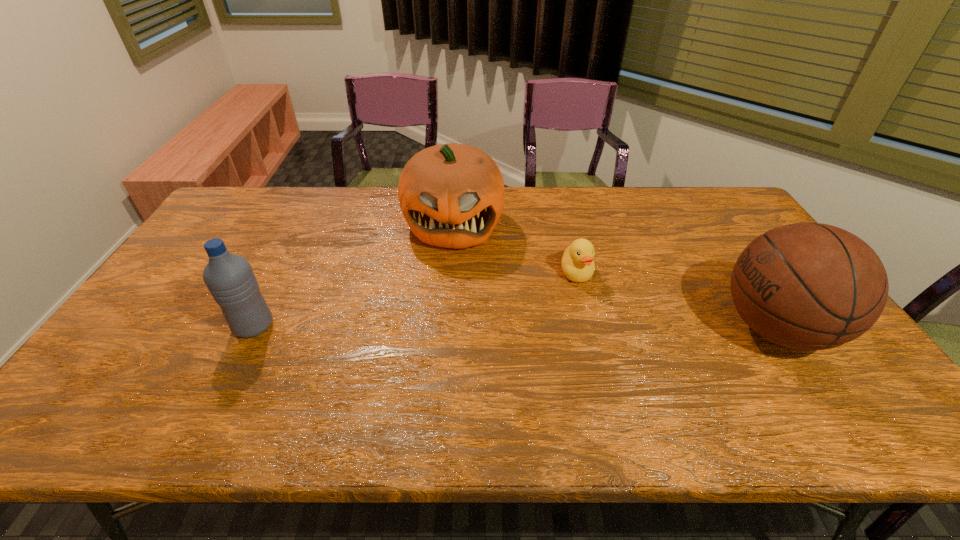
Identify the location of free spot located on the face of the third nearest object. This screenshot has height=540, width=960. (582, 300).

Locate an element on the screen. vacant space located 0.130m on the face of the third nearest object is located at coordinates (586, 322).

You are a GUI agent. You are given a task and a screenshot of the screen. Output one action in this format:
    pyautogui.click(x=<x>, y=<y>)
    Task: Click on the vacant position located 0.080m on the face of the third nearest object
    This screenshot has height=540, width=960.
    Given the screenshot: What is the action you would take?
    pyautogui.click(x=583, y=308)

The image size is (960, 540). In order to click on blank area located on the face of the pumpkin in this screenshot , I will do click(445, 329).

Locate an element on the screen. The width and height of the screenshot is (960, 540). vacant region located 0.060m on the face of the pumpkin is located at coordinates (450, 269).

Locate an element on the screen. This screenshot has width=960, height=540. vacant space located on the face of the pumpkin is located at coordinates (445, 332).

Find the location of a particular element. This screenshot has width=960, height=540. object present at the far edge is located at coordinates (451, 195).

Image resolution: width=960 pixels, height=540 pixels. What are the coordinates of `object at the near edge` in the screenshot? It's located at (809, 286).

The height and width of the screenshot is (540, 960). I want to click on object at the right edge, so click(809, 286).

Identify the location of object that is at the near right corner. (809, 286).